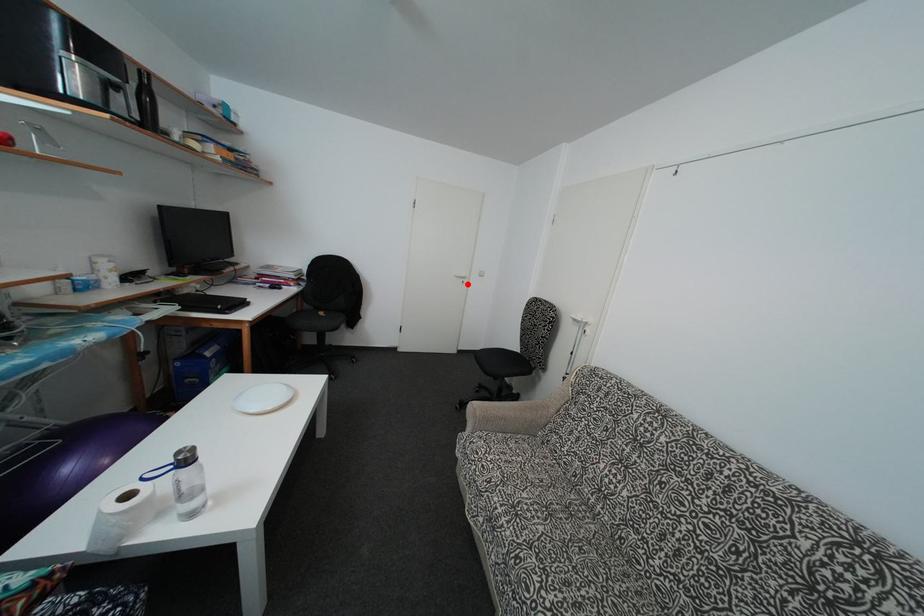
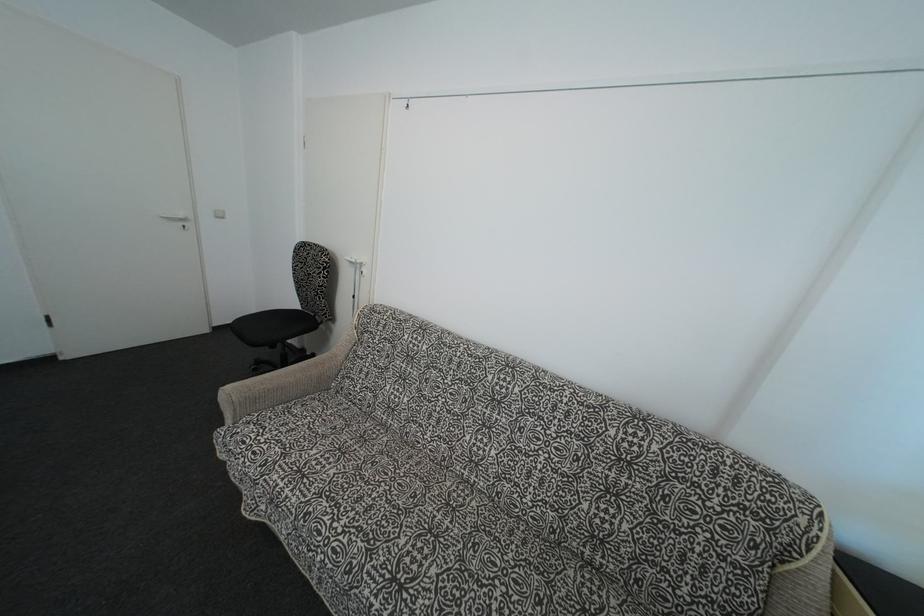
Question: I am providing you with two images of the same scene from different viewpoints. Given a red point in image1, look at the same physical point in image2. Is it:

Choices:
 (A) Closer to the viewpoint
 (B) Farther from the viewpoint

Answer: (B)